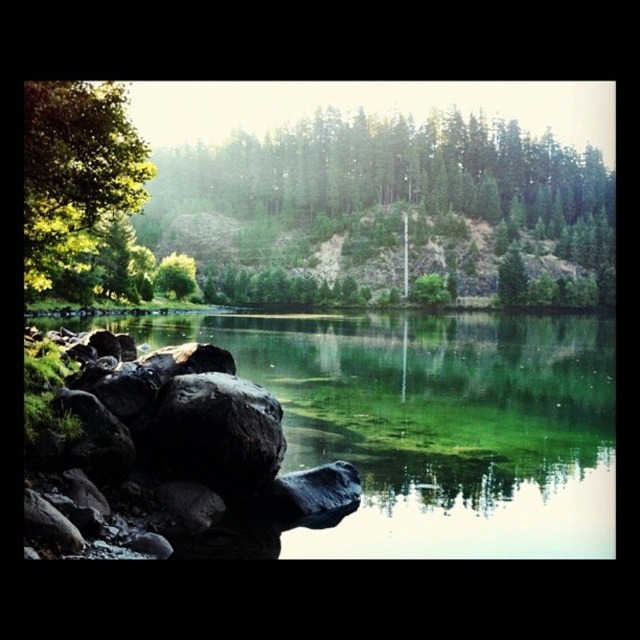
You are standing at the edge of the scene and want to walk towards the green leafy tree at left. Before you reach it, will you step onto the green smooth water at center first?

Yes, because the green smooth water at center is closer to the viewer than the green leafy tree at left, so you would step onto the green smooth water at center before reaching the green leafy tree at left.

Based on the coordinates provided, can you identify which object in the scene corresponds to the point at location (444, 426)?

The point at (444, 426) corresponds to the green smooth water at center.

You are a hiker who wants to cross the water using a 30 feet long wooden plank. You see the green leafy tree at left and the black matte rock at lower left. Can you place the plank between them to cross?

The distance between the green leafy tree at left and the black matte rock at lower left is 37.75 feet, which is longer than the 30 feet plank. Therefore, the plank cannot span the gap between them.